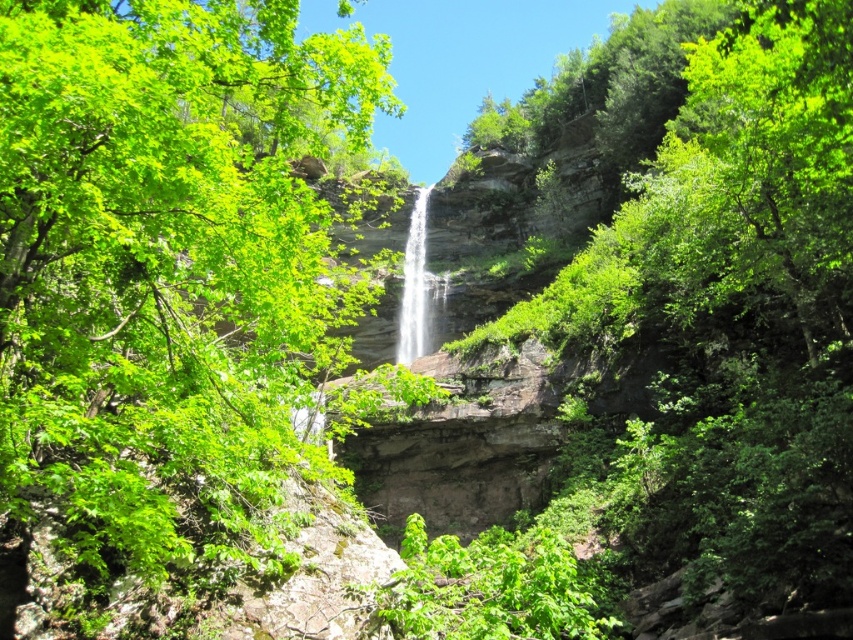
Question: Which of the following is the closest to the observer?

Choices:
 (A) (219, 170)
 (B) (415, 232)

Answer: (A)

Question: Which of the following is the farthest from the observer?

Choices:
 (A) (268, 188)
 (B) (405, 298)

Answer: (B)

Question: Observing the image, what is the correct spatial positioning of green leafy tree at center in reference to white smooth waterfall at center?

Choices:
 (A) right
 (B) left

Answer: (B)

Question: Is green leafy tree at center positioned behind white smooth waterfall at center?

Choices:
 (A) no
 (B) yes

Answer: (A)

Question: Does green leafy tree at center appear under white smooth waterfall at center?

Choices:
 (A) yes
 (B) no

Answer: (A)